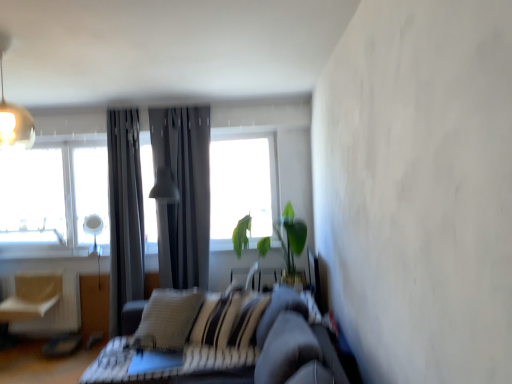
This screenshot has width=512, height=384. Find the location of `empty space that is ontop of light beige fabric swivel chair at left`. empty space that is ontop of light beige fabric swivel chair at left is located at coordinates (31, 274).